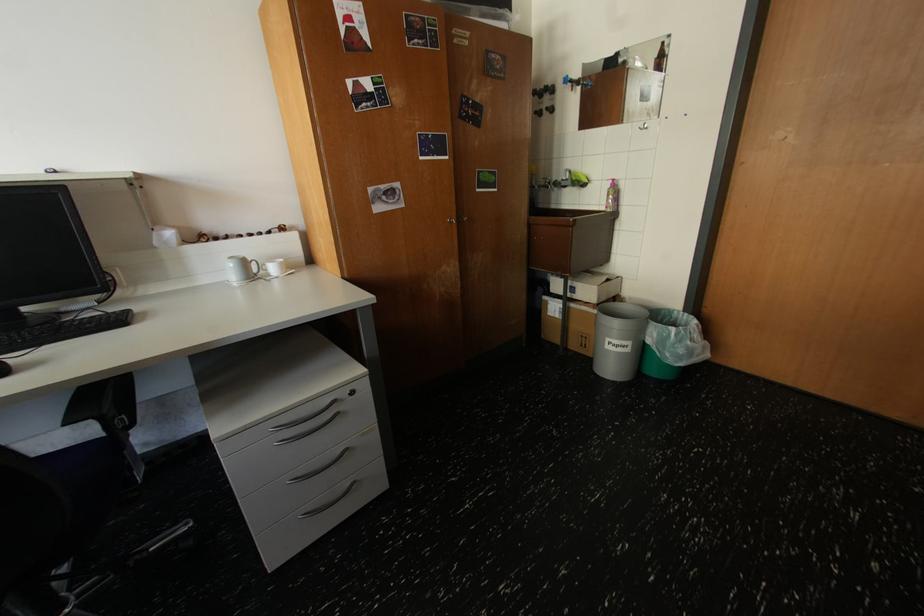
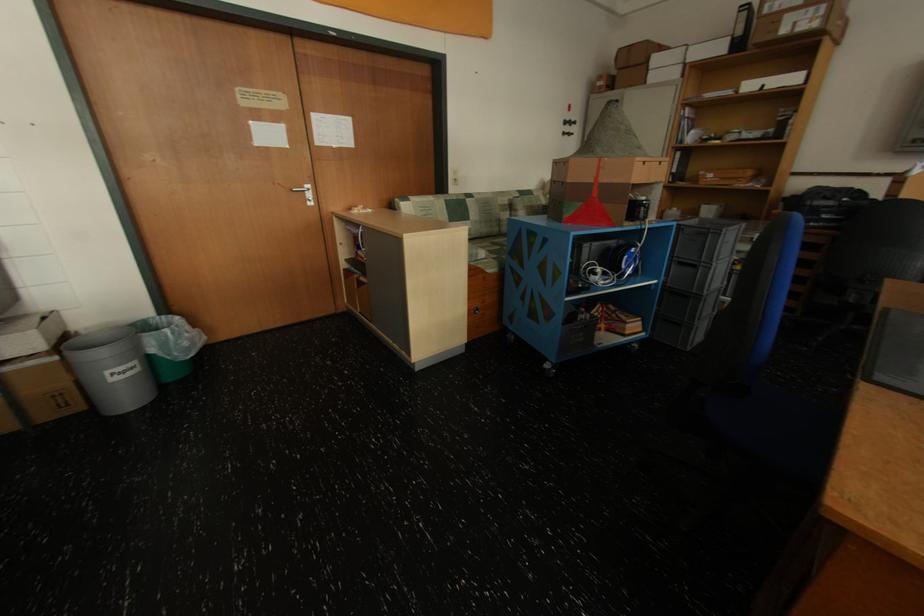
The point at [681,330] is marked in the first image. Where is the corresponding point in the second image?

(176, 331)